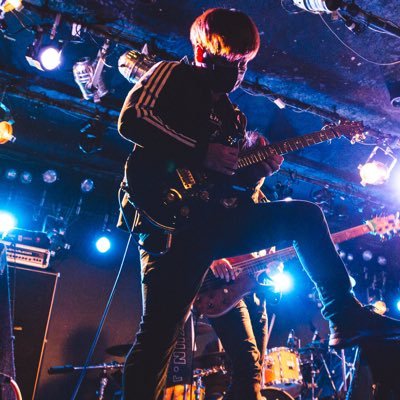
This screenshot has width=400, height=400. Find the location of `cord`. cord is located at coordinates (108, 304).